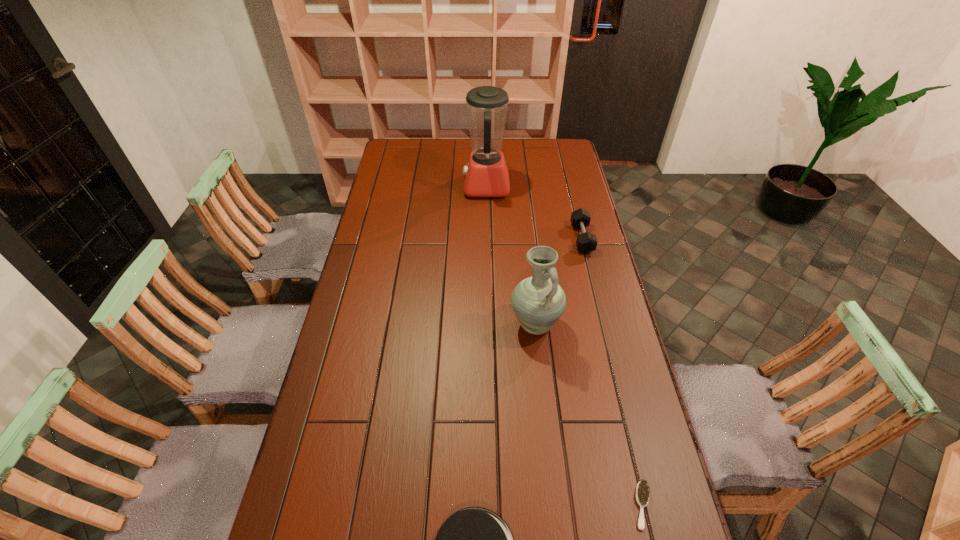
Find the location of a particular element. vacant point located between the dumbbell and the shortest object is located at coordinates (612, 372).

Locate an element on the screen. free space between the scrubbing brush and the farthest object is located at coordinates (564, 346).

Where is `free space between the third shortest object and the shortest object`? free space between the third shortest object and the shortest object is located at coordinates (612, 372).

This screenshot has width=960, height=540. In order to click on free spot between the dumbbell and the fourth shortest object in this screenshot , I will do `click(559, 281)`.

At what (x,y) coordinates should I click in order to perform the action: click on vacant space in between the scrubbing brush and the third nearest object. Please return your answer as a coordinate pair (x, y). Looking at the image, I should click on (588, 415).

Locate an element on the screen. This screenshot has height=540, width=960. free space between the third shortest object and the blender is located at coordinates (534, 213).

Find the location of a particular element. vacant area that lies between the pitcher and the dumbbell is located at coordinates (559, 281).

This screenshot has height=540, width=960. What are the coordinates of `object that is the second closest to the second tallest object` in the screenshot? It's located at (642, 490).

Locate which object is the second closest to the shortest object. Please provide its 2D coordinates. Your answer should be formatted as a tuple, i.e. [(x, y)], where the tuple contains the x and y coordinates of a point satisfying the conditions above.

[(539, 301)]

The height and width of the screenshot is (540, 960). I want to click on vacant region that satisfies the following two spatial constraints: 1. on the front of the blender near the controls; 2. on the back side of the scrubbing brush, so click(492, 505).